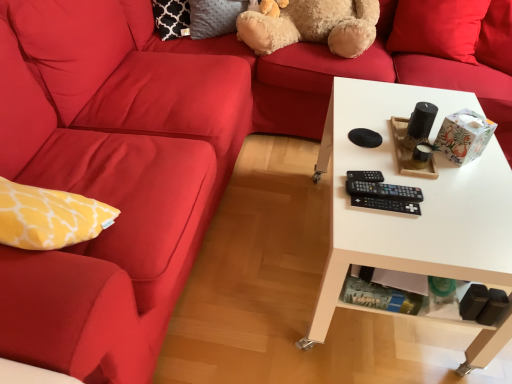
You are a GUI agent. You are given a task and a screenshot of the screen. Output one action in this format:
    pyautogui.click(x=<x>, y=<y>)
    Task: Click on the free location to the right of black plastic remote at center, the 1th control when ordered from front to back
    Image resolution: width=512 pixels, height=384 pixels.
    Given the screenshot: What is the action you would take?
    pyautogui.click(x=442, y=206)